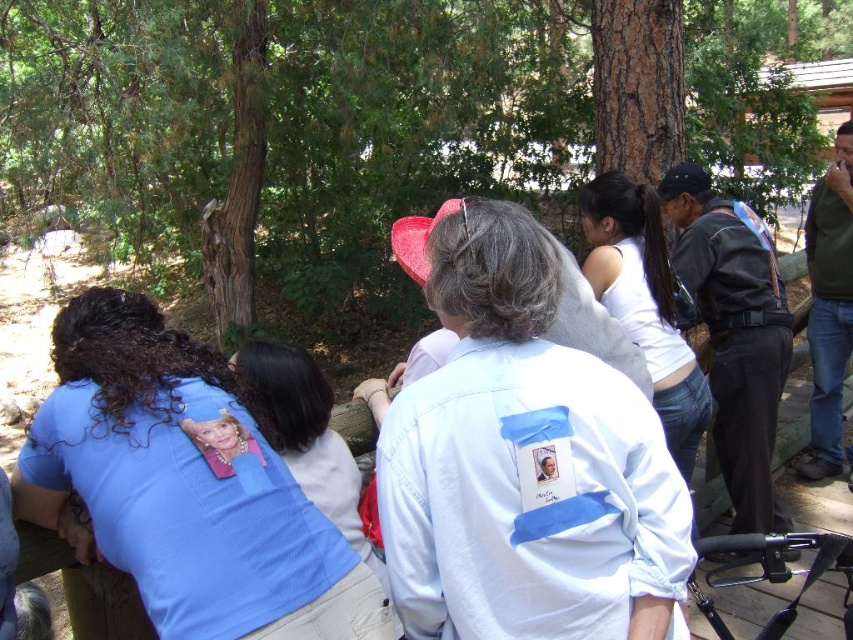
You are a photographer trying to capture both the blue mesh shirt at lower left and the white cotton tank top at upper right in a single shot. Based on their positions, which one would you need to focus on first if you want to ensure both are in focus?

The blue mesh shirt at lower left is located below the white cotton tank top at upper right. To ensure both are in focus, you should focus on the white cotton tank top at upper right first since it is farther away, allowing the depth of field to cover the closer blue mesh shirt at lower left.

From the picture: You are standing in the park scene and want to place a small flag at the point closer to you between point (241, 618) and point (636, 237). Which point should you choose?

You should choose point (241, 618) because it is closer to the viewer than point (636, 237).